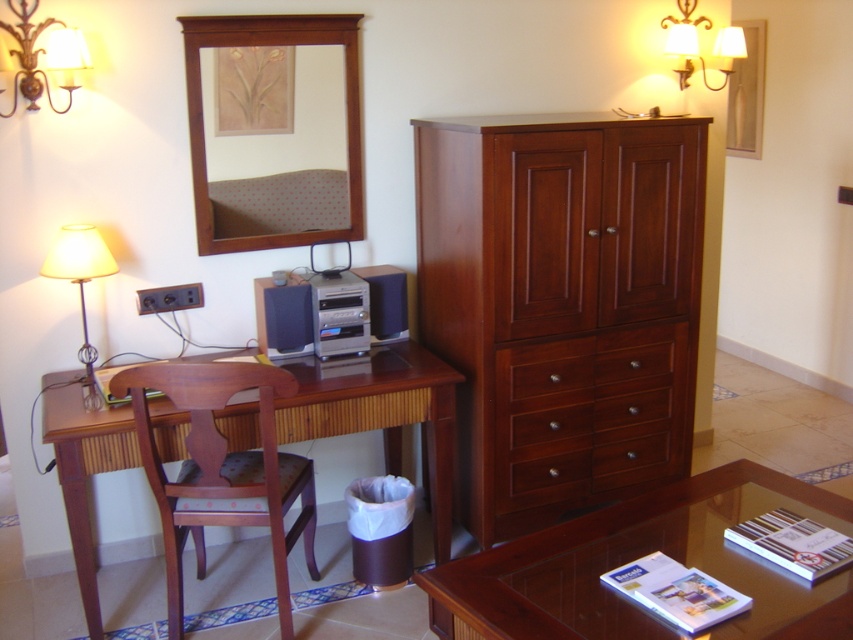
Is point (592, 380) behind point (677, 44)?

That is False.

Measure the distance between brown wood drawer at center right and camera.

2.93 meters

You are a GUI agent. You are given a task and a screenshot of the screen. Output one action in this format:
    pyautogui.click(x=<x>, y=<y>)
    Task: Click on the brown wood drawer at center right
    
    Given the screenshot: What is the action you would take?
    pyautogui.click(x=590, y=413)

Which of these two, matte gold wall sconce at upper left or matte white lampshade at left, stands shorter?

matte gold wall sconce at upper left is shorter.

Looking at this image, who is more forward, (x=22, y=51) or (x=97, y=273)?

Point (x=97, y=273)

At what (x,y) coordinates should I click in order to perform the action: click on matte gold wall sconce at upper left. Please return your answer as a coordinate pair (x, y). This screenshot has width=853, height=640. Looking at the image, I should click on (44, 52).

Consider the image. Which of these two, glossy wood coffee table at lower right or matte gold wall sconce at upper right, stands shorter?

glossy wood coffee table at lower right is shorter.

The height and width of the screenshot is (640, 853). In order to click on glossy wood coffee table at lower right in this screenshot , I will do `click(637, 557)`.

Does point (531, 618) come in front of point (693, 26)?

Yes.

The height and width of the screenshot is (640, 853). In order to click on glossy wood coffee table at lower right in this screenshot , I will do `click(637, 557)`.